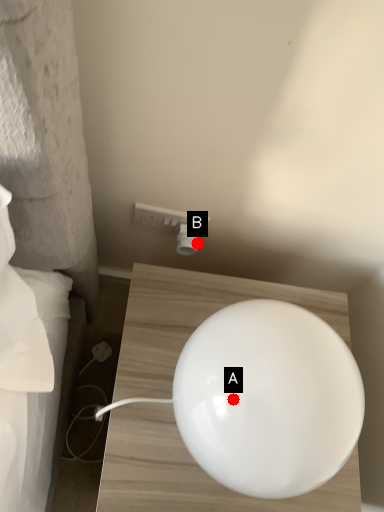
Question: Two points are circled on the image, labeled by A and B beside each circle. Which point is closer to the camera?

Choices:
 (A) A is closer
 (B) B is closer

Answer: (A)